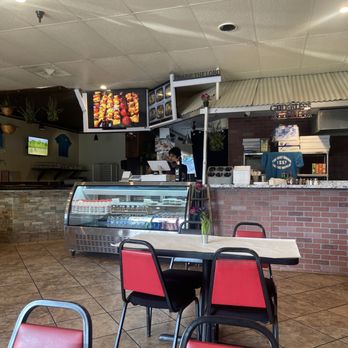
Image resolution: width=348 pixels, height=348 pixels. What are the coordinates of `table` in the screenshot? It's located at (274, 248).